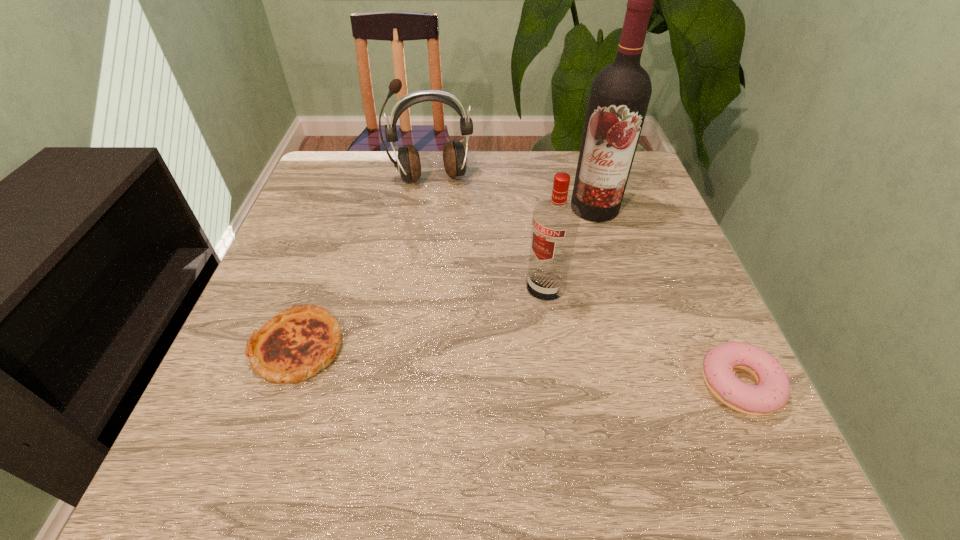
Image resolution: width=960 pixels, height=540 pixels. I want to click on quiche, so click(294, 345).

Where is `the leftmost object`? The image size is (960, 540). the leftmost object is located at coordinates (294, 345).

In order to click on the fourth tallest object in this screenshot , I will do `click(771, 393)`.

You are a GUI agent. You are given a task and a screenshot of the screen. Output one action in this format:
    pyautogui.click(x=<x>, y=<y>)
    Task: Click on the rightmost object
    This screenshot has height=540, width=960.
    Given the screenshot: What is the action you would take?
    pyautogui.click(x=771, y=393)

Locate an element on the screen. Image resolution: width=960 pixels, height=540 pixels. the fourth object from right to left is located at coordinates (407, 162).

Where is `the farthest object`? The image size is (960, 540). the farthest object is located at coordinates (407, 162).

Where is `wine bottle`? The image size is (960, 540). wine bottle is located at coordinates 619,97.

Locate an element on the screen. the fourth nearest object is located at coordinates (619, 97).

You are a GUI agent. You are given a task and a screenshot of the screen. Output one action in this format:
    pyautogui.click(x=<x>, y=<y>)
    Task: Click on the vodka
    This screenshot has width=960, height=540.
    Given the screenshot: What is the action you would take?
    pyautogui.click(x=555, y=222)

You are a GUI agent. You are given a task and a screenshot of the screen. Output one action in this format:
    pyautogui.click(x=<x>, y=<y>)
    Task: Click on the third farthest object
    
    Given the screenshot: What is the action you would take?
    pyautogui.click(x=555, y=222)